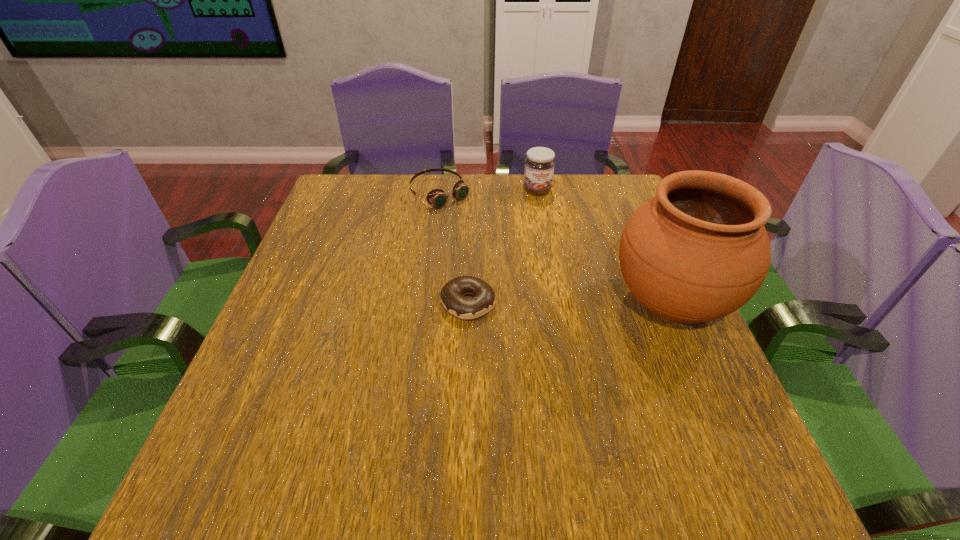
The width and height of the screenshot is (960, 540). In order to click on vacant space located 0.290m on the front label of the third shortest object in this screenshot , I will do `click(564, 264)`.

Locate an element on the screen. The image size is (960, 540). blank space located through the lenses of the goggles is located at coordinates (530, 274).

I want to click on free point located through the lenses of the goggles, so [466, 217].

Locate an element on the screen. The width and height of the screenshot is (960, 540). vacant space located through the lenses of the goggles is located at coordinates (507, 254).

You are a GUI agent. You are given a task and a screenshot of the screen. Output one action in this format:
    pyautogui.click(x=<x>, y=<y>)
    Task: Click on the jam that is at the far edge
    
    Given the screenshot: What is the action you would take?
    pyautogui.click(x=539, y=164)

Find the location of `goggles positioned at the far edge`. goggles positioned at the far edge is located at coordinates (437, 197).

Find the location of a particular element. object that is positioned at the right edge is located at coordinates (697, 251).

Where is `vacant space at the far edge`? The height and width of the screenshot is (540, 960). vacant space at the far edge is located at coordinates coord(507,212).

In the image, there is a desktop. At what (x,y) coordinates should I click in order to perform the action: click on vacant space at the left edge. Please return your answer as a coordinate pair (x, y). Looking at the image, I should click on (286, 377).

This screenshot has width=960, height=540. I want to click on free location at the right edge, so click(x=669, y=370).